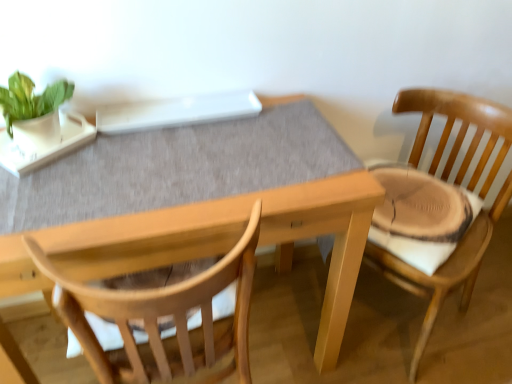
Where is `vacant space in front of green matte plant at upper left`? The image size is (512, 384). vacant space in front of green matte plant at upper left is located at coordinates (45, 187).